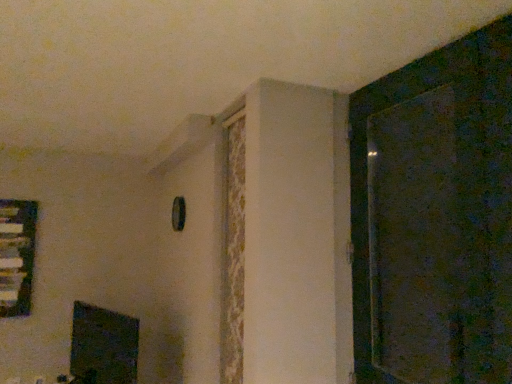
Question: Considering the relative sizes of dark textured screen door at right and black glossy fireplace at lower left in the image provided, is dark textured screen door at right bigger than black glossy fireplace at lower left?

Choices:
 (A) no
 (B) yes

Answer: (B)

Question: From a real-world perspective, is dark textured screen door at right beneath black glossy fireplace at lower left?

Choices:
 (A) yes
 (B) no

Answer: (B)

Question: Is dark textured screen door at right further to the viewer compared to black glossy fireplace at lower left?

Choices:
 (A) no
 (B) yes

Answer: (A)

Question: Does dark textured screen door at right have a greater height compared to black glossy fireplace at lower left?

Choices:
 (A) no
 (B) yes

Answer: (B)

Question: From the image's perspective, would you say dark textured screen door at right is positioned over black glossy fireplace at lower left?

Choices:
 (A) yes
 (B) no

Answer: (A)

Question: Is black glossy fireplace at lower left bigger or smaller than clear glass window at left?

Choices:
 (A) big
 (B) small

Answer: (A)

Question: Would you say black glossy fireplace at lower left is inside or outside clear glass window at left?

Choices:
 (A) outside
 (B) inside

Answer: (A)

Question: Relative to clear glass window at left, is black glossy fireplace at lower left in front or behind?

Choices:
 (A) front
 (B) behind

Answer: (A)

Question: In terms of width, does black glossy fireplace at lower left look wider or thinner when compared to clear glass window at left?

Choices:
 (A) wide
 (B) thin

Answer: (A)

Question: Is clear glass window at left to the left or to the right of black glossy fireplace at lower left in the image?

Choices:
 (A) left
 (B) right

Answer: (A)

Question: In terms of size, does clear glass window at left appear bigger or smaller than black glossy fireplace at lower left?

Choices:
 (A) big
 (B) small

Answer: (B)

Question: Which is correct: clear glass window at left is inside black glossy fireplace at lower left, or outside of it?

Choices:
 (A) outside
 (B) inside

Answer: (A)

Question: Is point (1, 221) positioned closer to the camera than point (123, 336)?

Choices:
 (A) farther
 (B) closer

Answer: (B)

Question: Does point (368, 145) appear closer or farther from the camera than point (124, 354)?

Choices:
 (A) farther
 (B) closer

Answer: (B)

Question: Is dark textured screen door at right to the left or to the right of black glossy fireplace at lower left in the image?

Choices:
 (A) left
 (B) right

Answer: (B)